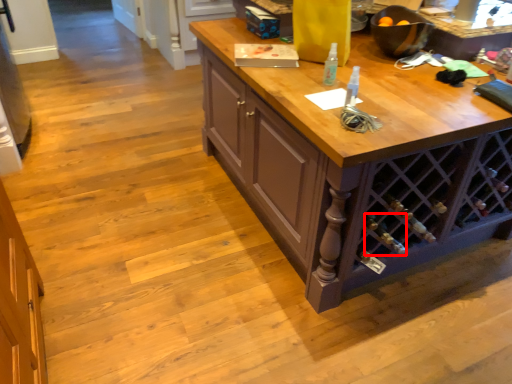
Question: Observing the image, what is the correct spatial positioning of wine bottle (annotated by the red box) in reference to bottle?

Choices:
 (A) left
 (B) right

Answer: (B)